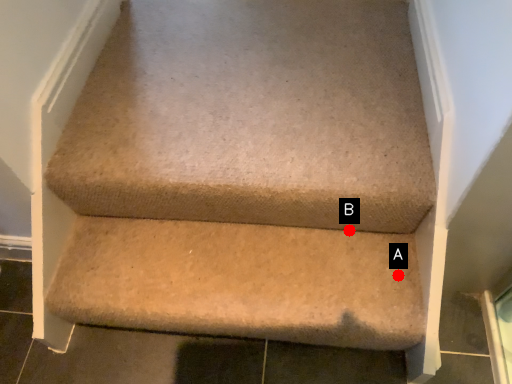
Question: Two points are circled on the image, labeled by A and B beside each circle. Which point is farther to the camera?

Choices:
 (A) A is further
 (B) B is further

Answer: (B)